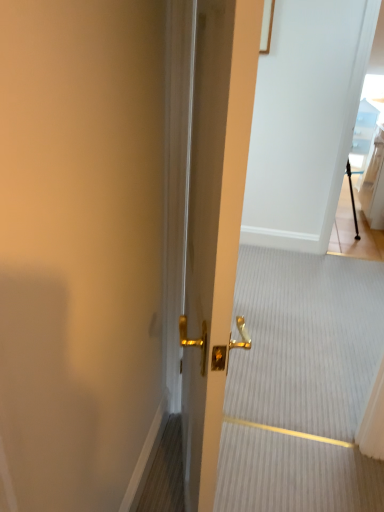
The image size is (384, 512). Describe the element at coordinates (354, 231) in the screenshot. I see `transparent glass door at upper right` at that location.

Locate an element on the screen. Image resolution: width=384 pixels, height=512 pixels. metallic gold door handle at center is located at coordinates (301, 385).

At what (x,y) coordinates should I click in order to perform the action: click on transparent glass door at upper right. Please return your answer as a coordinate pair (x, y). This screenshot has height=512, width=384. Looking at the image, I should click on (354, 231).

In the scene shown: Which of these two, transparent glass door at upper right or gold metallic door handle at center, is thinner?

transparent glass door at upper right.

Between transparent glass door at upper right and gold metallic door handle at center, which one has larger size?

Bigger between the two is gold metallic door handle at center.

How many degrees apart are the facing directions of transparent glass door at upper right and gold metallic door handle at center?

The facing directions of transparent glass door at upper right and gold metallic door handle at center are 106 degrees apart.

Is transparent glass door at upper right to the left or to the right of gold metallic door handle at center in the image?

transparent glass door at upper right is to the right of gold metallic door handle at center.

Would you say gold metallic door handle at center is outside metallic gold door handle at center?

Absolutely, gold metallic door handle at center is external to metallic gold door handle at center.

Considering the positions of objects gold metallic door handle at center and metallic gold door handle at center in the image provided, who is in front, gold metallic door handle at center or metallic gold door handle at center?

gold metallic door handle at center is closer to the camera.

Consider the image. Between gold metallic door handle at center and metallic gold door handle at center, which one appears on the left side from the viewer's perspective?

Positioned to the left is gold metallic door handle at center.

The height and width of the screenshot is (512, 384). I want to click on door lying in front of the metallic gold door handle at center, so click(x=214, y=226).

How much distance is there between transparent glass door at upper right and metallic gold door handle at center?

A distance of 1.32 meters exists between transparent glass door at upper right and metallic gold door handle at center.

Based on the photo, is metallic gold door handle at center inside transparent glass door at upper right?

No, transparent glass door at upper right does not contain metallic gold door handle at center.

Where is `glass door lying on the right of metallic gold door handle at center`? The height and width of the screenshot is (512, 384). glass door lying on the right of metallic gold door handle at center is located at coordinates (354, 231).

Is metallic gold door handle at center at the back of transparent glass door at upper right?

No, transparent glass door at upper right is not facing away from metallic gold door handle at center.

Is gold metallic door handle at center situated inside transparent glass door at upper right or outside?

gold metallic door handle at center is located beyond the bounds of transparent glass door at upper right.

How different are the orientations of gold metallic door handle at center and transparent glass door at upper right in degrees?

gold metallic door handle at center and transparent glass door at upper right are facing 106 degrees away from each other.

How distant is gold metallic door handle at center from transparent glass door at upper right?

gold metallic door handle at center is 2.57 meters away from transparent glass door at upper right.

Does gold metallic door handle at center have a lesser width compared to transparent glass door at upper right?

In fact, gold metallic door handle at center might be wider than transparent glass door at upper right.

Who is shorter, metallic gold door handle at center or gold metallic door handle at center?

With less height is metallic gold door handle at center.

Which object is thinner, metallic gold door handle at center or gold metallic door handle at center?

Thinner between the two is gold metallic door handle at center.

Is metallic gold door handle at center touching gold metallic door handle at center?

No, metallic gold door handle at center is not in contact with gold metallic door handle at center.

Looking at this image, from a real-world perspective, which object rests below the other?

In real-world perspective, metallic gold door handle at center is lower.

In the scene shown: Is metallic gold door handle at center in front of or behind transparent glass door at upper right in the image?

Visually, metallic gold door handle at center is located in front of transparent glass door at upper right.

Which is more distant, (x=259, y=325) or (x=354, y=231)?

Positioned behind is point (x=354, y=231).

Considering the sizes of objects metallic gold door handle at center and transparent glass door at upper right in the image provided, who is wider, metallic gold door handle at center or transparent glass door at upper right?

metallic gold door handle at center is wider.

Identify the location of door below the transparent glass door at upper right (from the image's perspective). (214, 226).

Locate an element on the screen. The image size is (384, 512). door that appears in front of the metallic gold door handle at center is located at coordinates (214, 226).

From the picture: Which object lies nearer to the anchor point gold metallic door handle at center, metallic gold door handle at center or transparent glass door at upper right?

Based on the image, metallic gold door handle at center appears to be nearer to gold metallic door handle at center.

Considering their positions, is transparent glass door at upper right positioned closer to metallic gold door handle at center than gold metallic door handle at center?

gold metallic door handle at center lies closer to metallic gold door handle at center than the other object.

When comparing their distances from transparent glass door at upper right, does metallic gold door handle at center or gold metallic door handle at center seem closer?

Based on the image, metallic gold door handle at center appears to be nearer to transparent glass door at upper right.

Looking at the image, which one is located further to metallic gold door handle at center, gold metallic door handle at center or transparent glass door at upper right?

Among the two, transparent glass door at upper right is located further to metallic gold door handle at center.

From the image, which object appears to be nearer to gold metallic door handle at center, transparent glass door at upper right or metallic gold door handle at center?

Among the two, metallic gold door handle at center is located nearer to gold metallic door handle at center.

Which object lies further to the anchor point transparent glass door at upper right, gold metallic door handle at center or metallic gold door handle at center?

gold metallic door handle at center.

Image resolution: width=384 pixels, height=512 pixels. I want to click on stair between gold metallic door handle at center and transparent glass door at upper right along the z-axis, so point(301,385).